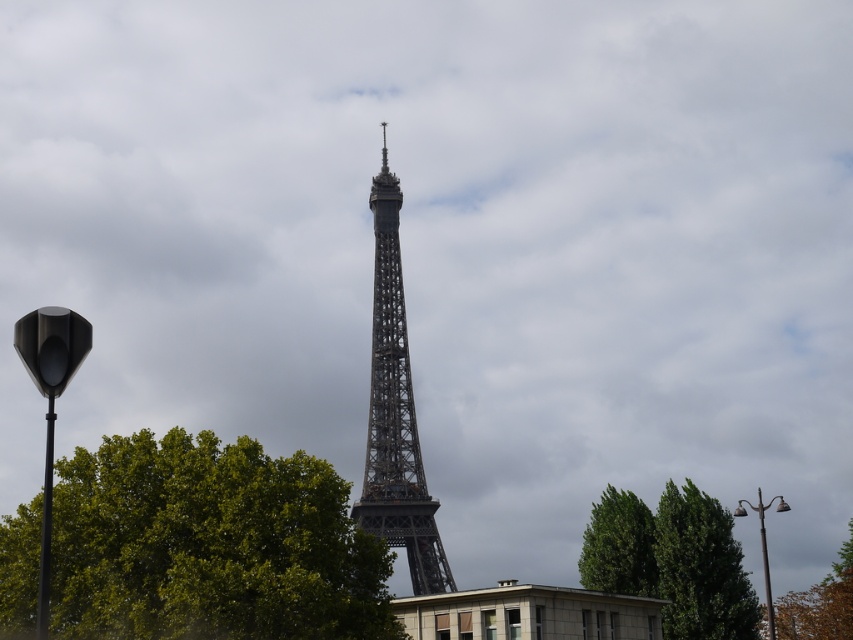
Between point (387, 396) and point (650, 518), which one is positioned in front?

Positioned in front is point (650, 518).

Is point (392, 412) positioned before point (614, 577)?

No, it is not.

In order to click on metallic lattice tower at center in this screenshot , I will do `click(395, 412)`.

Is point (664, 589) closer to viewer compared to point (402, 292)?

Yes, it is.

Who is more distant from viewer, [676,588] or [374,248]?

The point [374,248] is more distant.

Where is `green leafy tree at lower right`? The width and height of the screenshot is (853, 640). green leafy tree at lower right is located at coordinates (672, 561).

Who is more forward, (128, 524) or (821, 604)?

Positioned in front is point (128, 524).

Which is more to the right, green leafy tree at center or brown leafy tree at lower right?

From the viewer's perspective, brown leafy tree at lower right appears more on the right side.

Between point (96, 589) and point (831, 627), which one is positioned in front?

Point (96, 589) is in front.

Locate an element on the screen. The height and width of the screenshot is (640, 853). green leafy tree at center is located at coordinates (210, 545).